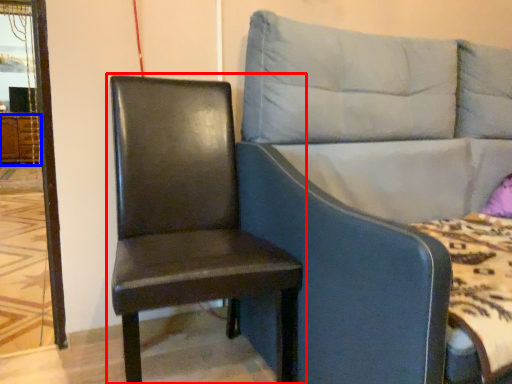
Question: Which object appears closest to the camera in this image, chair (highlighted by a red box) or dresser (highlighted by a blue box)?

Choices:
 (A) chair
 (B) dresser

Answer: (A)